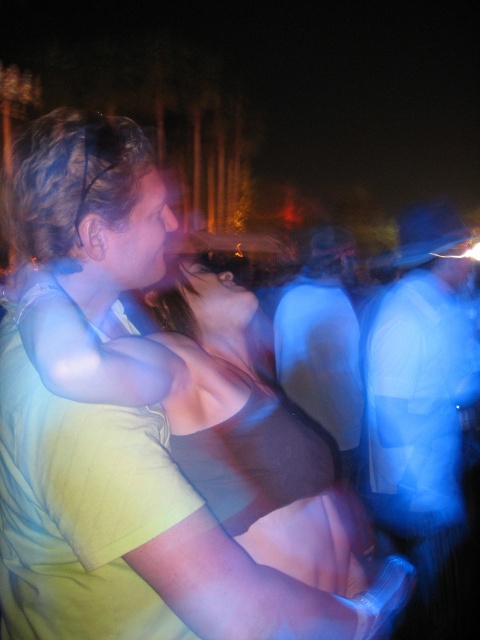
Looking at this image, you are a photographer standing at the edge of the event. You want to capture a clear photo of the matte black tank top at center. The camera requires a minimum distance of 1.2 meters to focus properly. Can you take a clear photo from your current position?

The matte black tank top at center is 1.14 meters away from the viewer. Since the required minimum distance is 1.2 meters, the photographer cannot take a clear photo from the current position as the distance is insufficient.

You are at a party and need to decide which clothing item to grab quickly. Given the matte black tank top at center and the blue fabric shirt at right, which one is smaller in size?

The matte black tank top at center is smaller in size compared to the blue fabric shirt at right.